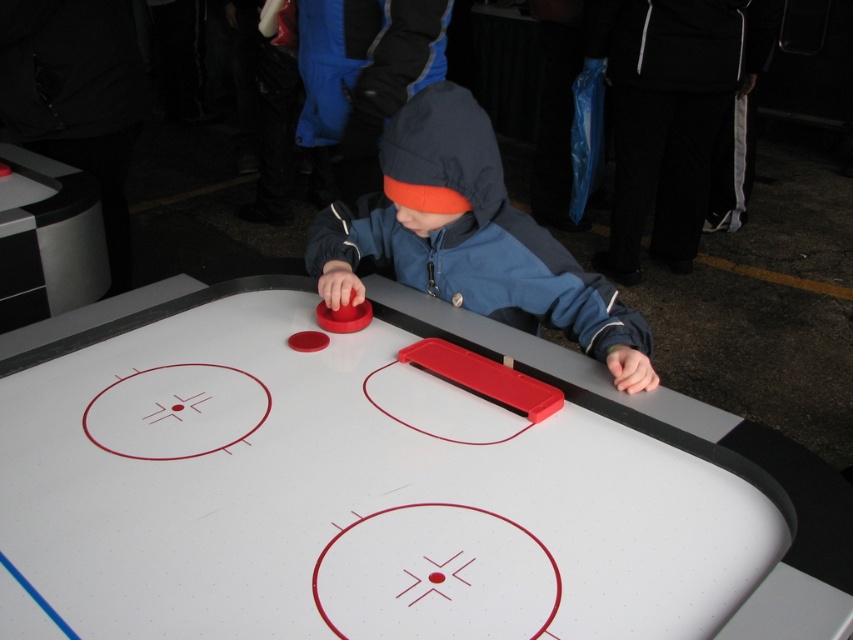
Question: Which object appears closest to the camera in this image?

Choices:
 (A) white glossy air hockey table at center
 (B) matte blue jacket at center

Answer: (A)

Question: Which point appears farthest from the camera in this image?

Choices:
 (A) (445, 275)
 (B) (329, 534)

Answer: (A)

Question: Which object is closer to the camera taking this photo?

Choices:
 (A) white glossy air hockey table at center
 (B) matte blue jacket at center

Answer: (A)

Question: Can you confirm if white glossy air hockey table at center is positioned below matte blue jacket at center?

Choices:
 (A) no
 (B) yes

Answer: (B)

Question: Can you confirm if white glossy air hockey table at center is positioned to the right of matte blue jacket at center?

Choices:
 (A) no
 (B) yes

Answer: (A)

Question: Observing the image, what is the correct spatial positioning of white glossy air hockey table at center in reference to matte blue jacket at center?

Choices:
 (A) right
 (B) left

Answer: (B)